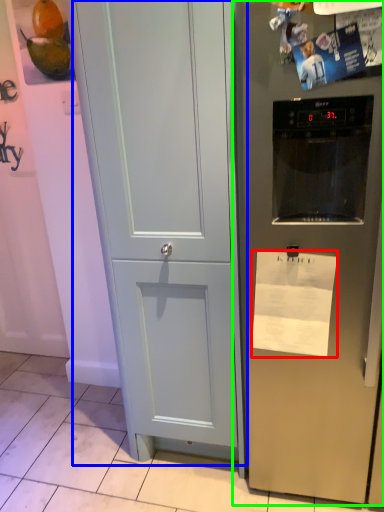
Question: Estimate the real-world distances between objects in this image. Which object is farther from paper (highlighted by a red box), door (highlighted by a blue box) or refrigerator (highlighted by a green box)?

Choices:
 (A) door
 (B) refrigerator

Answer: (A)